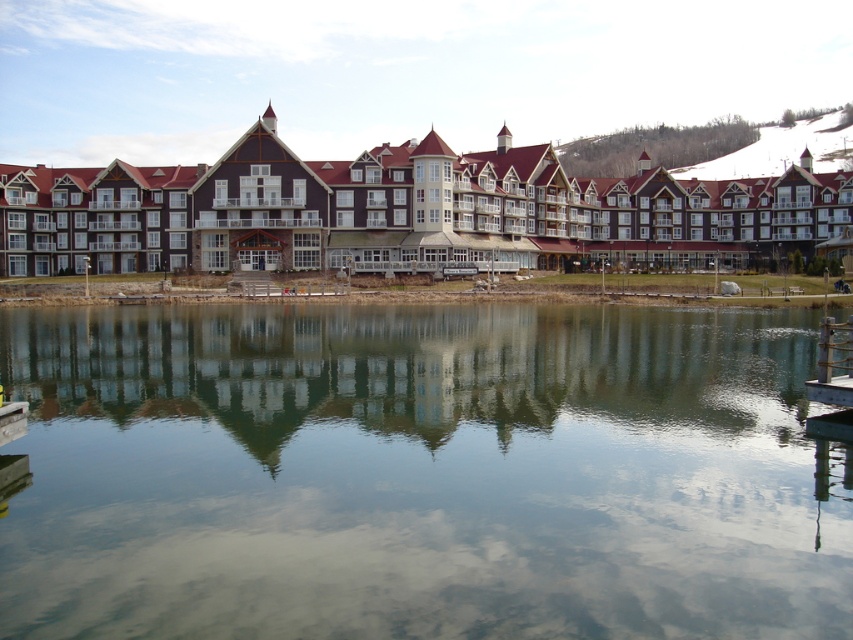
You are planning to host a small event and need to decide where to set up a booth. The brown wooden resort at center and the wooden dock at lower right are both available. Which location offers more horizontal space for your booth setup?

The brown wooden resort at center offers more horizontal space for the booth setup because its width is larger than the wooden dock at lower right.

You are a photographer planning to capture the brown wooden resort at center and the wooden dock at lower right in a single frame. Based on their sizes, which object should you focus on to ensure both are clearly visible in the photo?

The brown wooden resort at center is larger in size than the wooden dock at lower right, so focusing on the brown wooden resort at center would ensure both objects are clearly visible in the photo.